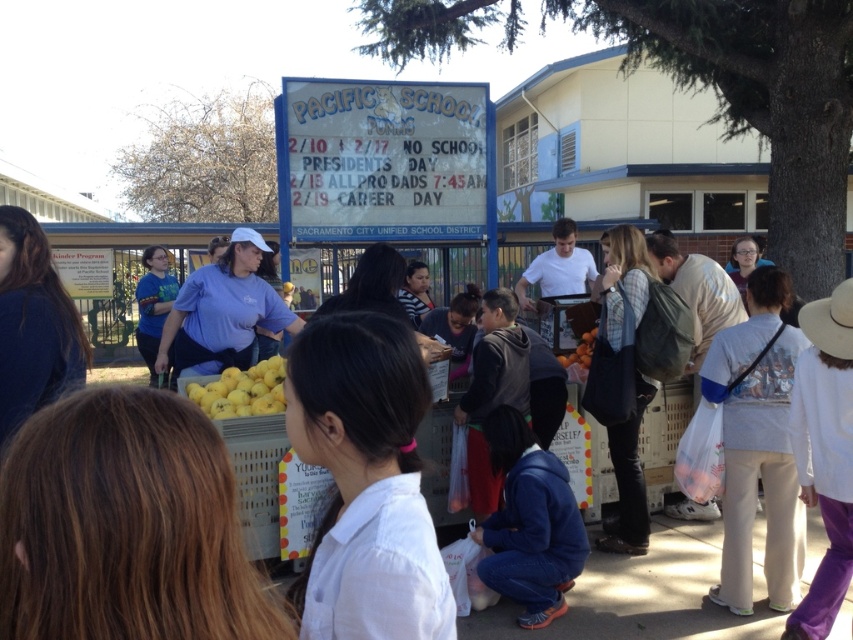
Which is more to the right, blue fleece jacket at lower center or yellow matte/yellowish-orange matte/yellowish-orange matte/yellowish-orange matte/yellowish-orange matte/yellowish-orange matte/yellowish-orange matte/yellowish-orange matte/yellowish-orange matte/yellowish-orange matte/yellowish-orange matte/yellowish-orange matte/yellowish-orange matte/yellowish-orange matte/yellowish-orange matte/yellowish-orange matte/yellowish-orange matte/yellowish-orange matte/yellowish-orange matte/yellowish-orange matte/yellowish-orange matte/yellowish-orange matte/yellowish-orange matte/yellowish-orange matte/yellowish-orange matte/yellowish-orange matte/y?

Positioned to the right is blue fleece jacket at lower center.

Does point (555, 488) lie behind point (242, 376)?

No, (555, 488) is in front of (242, 376).

Where is `blue fleece jacket at lower center`? The height and width of the screenshot is (640, 853). blue fleece jacket at lower center is located at coordinates (529, 522).

Does yellow matte/yellowish-orange matte/yellowish-orange matte/yellowish-orange matte/yellowish-orange matte/yellowish-orange matte/yellowish-orange matte/yellowish-orange matte/yellowish-orange matte/yellowish-orange matte/yellowish-orange matte/yellowish-orange matte/yellowish-orange matte/yellowish-orange matte/yellowish-orange matte/yellowish-orange matte/yellowish-orange matte/yellowish-orange matte/yellowish-orange matte/yellowish-orange matte/yellowish-orange matte/yellowish-orange matte/yellowish-orange matte/yellowish-orange matte/yellowish-orange matte/yellowish-orange matte/y appear over orange matte at center?

Actually, yellow matte/yellowish-orange matte/yellowish-orange matte/yellowish-orange matte/yellowish-orange matte/yellowish-orange matte/yellowish-orange matte/yellowish-orange matte/yellowish-orange matte/yellowish-orange matte/yellowish-orange matte/yellowish-orange matte/yellowish-orange matte/yellowish-orange matte/yellowish-orange matte/yellowish-orange matte/yellowish-orange matte/yellowish-orange matte/yellowish-orange matte/yellowish-orange matte/yellowish-orange matte/yellowish-orange matte/yellowish-orange matte/yellowish-orange matte/yellowish-orange matte/yellowish-orange matte/y is below orange matte at center.

Can you confirm if yellow matte/yellowish-orange matte/yellowish-orange matte/yellowish-orange matte/yellowish-orange matte/yellowish-orange matte/yellowish-orange matte/yellowish-orange matte/yellowish-orange matte/yellowish-orange matte/yellowish-orange matte/yellowish-orange matte/yellowish-orange matte/yellowish-orange matte/yellowish-orange matte/yellowish-orange matte/yellowish-orange matte/yellowish-orange matte/yellowish-orange matte/yellowish-orange matte/yellowish-orange matte/yellowish-orange matte/yellowish-orange matte/yellowish-orange matte/yellowish-orange matte/yellowish-orange matte/y is wider than orange matte at center?

Correct, the width of yellow matte/yellowish-orange matte/yellowish-orange matte/yellowish-orange matte/yellowish-orange matte/yellowish-orange matte/yellowish-orange matte/yellowish-orange matte/yellowish-orange matte/yellowish-orange matte/yellowish-orange matte/yellowish-orange matte/yellowish-orange matte/yellowish-orange matte/yellowish-orange matte/yellowish-orange matte/yellowish-orange matte/yellowish-orange matte/yellowish-orange matte/yellowish-orange matte/yellowish-orange matte/yellowish-orange matte/yellowish-orange matte/yellowish-orange matte/yellowish-orange matte/yellowish-orange matte/y exceeds that of orange matte at center.

Does point (229, 410) come closer to viewer compared to point (561, 364)?

Yes, point (229, 410) is in front of point (561, 364).

Locate an element on the screen. The width and height of the screenshot is (853, 640). yellow matte/yellowish-orange matte/yellowish-orange matte/yellowish-orange matte/yellowish-orange matte/yellowish-orange matte/yellowish-orange matte/yellowish-orange matte/yellowish-orange matte/yellowish-orange matte/yellowish-orange matte/yellowish-orange matte/yellowish-orange matte/yellowish-orange matte/yellowish-orange matte/yellowish-orange matte/yellowish-orange matte/yellowish-orange matte/yellowish-orange matte/yellowish-orange matte/yellowish-orange matte/yellowish-orange matte/yellowish-orange matte/yellowish-orange matte/yellowish-orange matte/yellowish-orange matte/y is located at coordinates (242, 390).

Does point (532, 483) lie in front of point (595, 336)?

That is True.

Can you confirm if blue fleece jacket at lower center is smaller than orange matte at center?

No.

Is point (558, 611) less distant than point (573, 358)?

Yes, it is.

The height and width of the screenshot is (640, 853). In order to click on blue fleece jacket at lower center in this screenshot , I will do `click(529, 522)`.